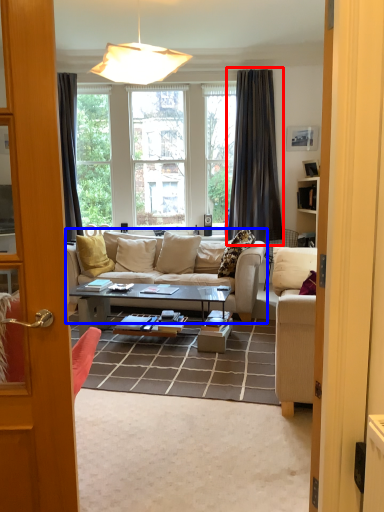
Question: Among these objects, which one is farthest to the camera, curtain (highlighted by a red box) or studio couch (highlighted by a blue box)?

Choices:
 (A) curtain
 (B) studio couch

Answer: (A)